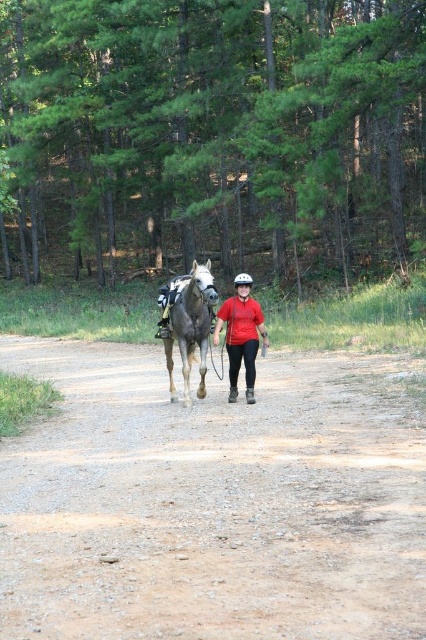
Between point (175, 506) and point (235, 316), which one is positioned behind?

Point (235, 316)

Based on the photo, which of these two, brown gravel dirt track at center or matte red shirt at center, stands shorter?

With less height is brown gravel dirt track at center.

Is point (411, 536) behind point (250, 288)?

No, it is in front of (250, 288).

Where is `brown gravel dirt track at center`? brown gravel dirt track at center is located at coordinates (212, 502).

Between brown gravel dirt track at center and brown textured horse at center, which one is positioned lower?

brown gravel dirt track at center is below.

Who is positioned more to the left, brown gravel dirt track at center or brown textured horse at center?

brown textured horse at center

Which is behind, point (345, 550) or point (189, 285)?

The point (189, 285) is more distant.

Where is `brown gravel dirt track at center`? brown gravel dirt track at center is located at coordinates click(212, 502).

Which is more to the right, brown textured horse at center or matte red shirt at center?

matte red shirt at center is more to the right.

Is brown textured horse at center shorter than matte red shirt at center?

In fact, brown textured horse at center may be taller than matte red shirt at center.

Does point (178, 305) lie in front of point (233, 332)?

Yes, it is in front of point (233, 332).

Where is `brown textured horse at center`? The width and height of the screenshot is (426, 640). brown textured horse at center is located at coordinates (187, 323).